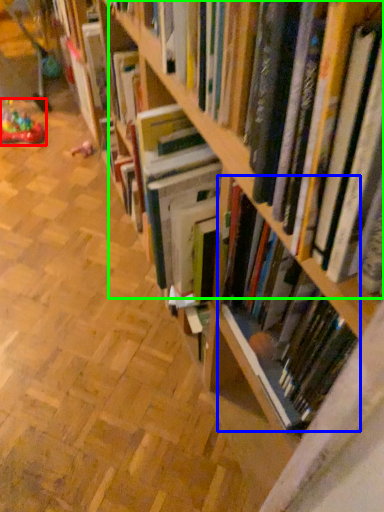
Question: Which object is positioned farthest from toy (highlighted by a red box)? Select from book (highlighted by a blue box) and book (highlighted by a green box).

Choices:
 (A) book
 (B) book

Answer: (A)